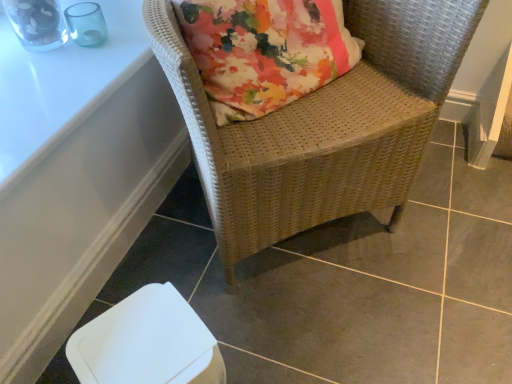
This screenshot has height=384, width=512. I want to click on vacant area that lies to the right of woven wicker chair at upper right, so click(x=453, y=224).